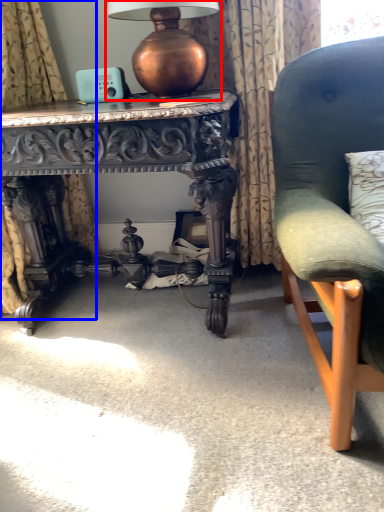
Question: Which point is closer to the camera, table lamp (highlighted by a red box) or curtain (highlighted by a blue box)?

Choices:
 (A) table lamp
 (B) curtain

Answer: (B)